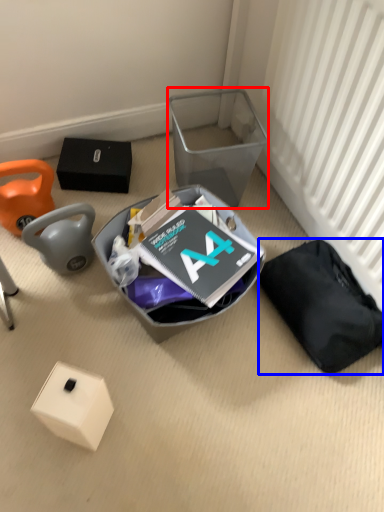
Question: Which object is closer to the camera taking this photo, shoe box (highlighted by a red box) or waste (highlighted by a blue box)?

Choices:
 (A) shoe box
 (B) waste

Answer: (B)